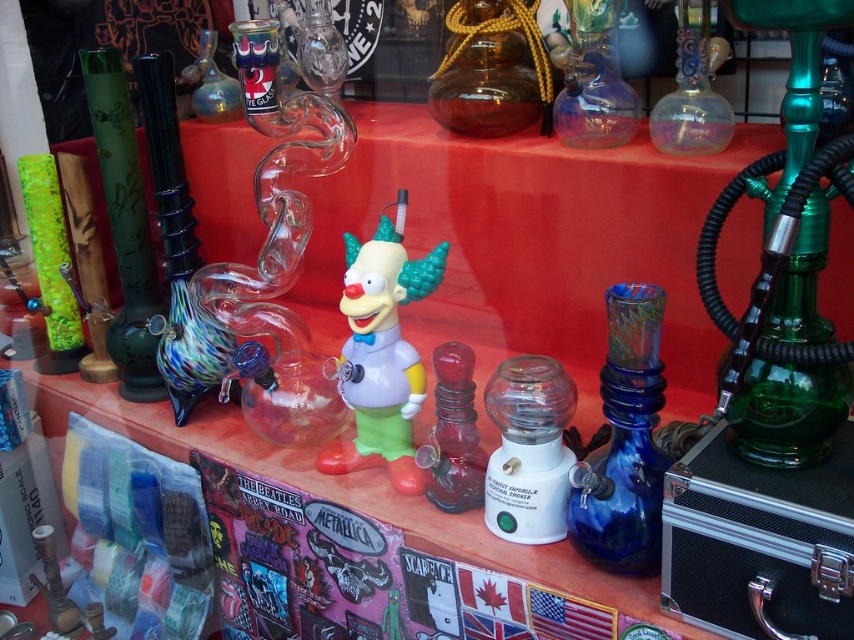
Question: Which object appears closest to the camera in this image?

Choices:
 (A) amber glass bottle at center
 (B) translucent plastic gumball machine at center
 (C) translucent glass vase at upper center

Answer: (B)

Question: Observing the image, what is the correct spatial positioning of amber glass bottle at center in reference to transparent glass pipe at upper right?

Choices:
 (A) above
 (B) below

Answer: (A)

Question: Based on their relative distances, which object is farther from the translucent glass vase at upper center?

Choices:
 (A) transparent glass vase at center
 (B) translucent glass bong at center
 (C) blue glass pipe at center
 (D) translucent plastic gumball machine at center

Answer: (C)

Question: Can you confirm if transparent glass pipe at upper right is positioned to the right of transparent glass vase at center?

Choices:
 (A) no
 (B) yes

Answer: (B)

Question: Can you confirm if translucent purple glass vase at center is smaller than translucent glass bong at center?

Choices:
 (A) yes
 (B) no

Answer: (B)

Question: Estimate the real-world distances between objects in this image. Which object is farther from the amber glass bottle at center?

Choices:
 (A) transparent glass pipe at upper right
 (B) blue glass pipe at center
 (C) translucent plastic gumball machine at center
 (D) rubber clown at center

Answer: (B)